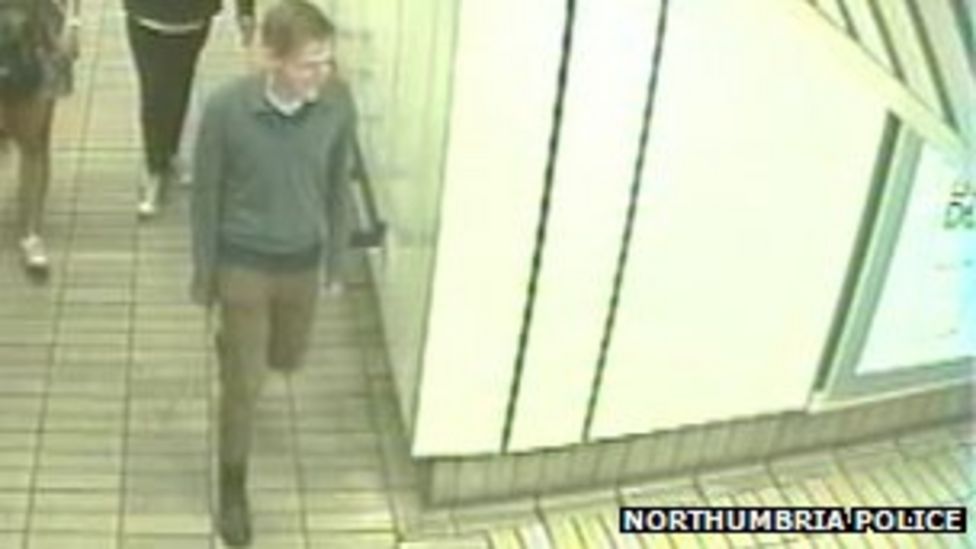
The image size is (976, 549). In order to click on poster in this screenshot , I will do `click(919, 239)`.